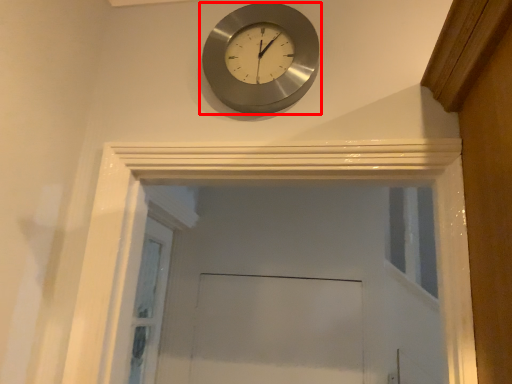
Question: Observing the image, what is the correct spatial positioning of wall clock (annotated by the red box) in reference to screen door?

Choices:
 (A) left
 (B) right

Answer: (B)